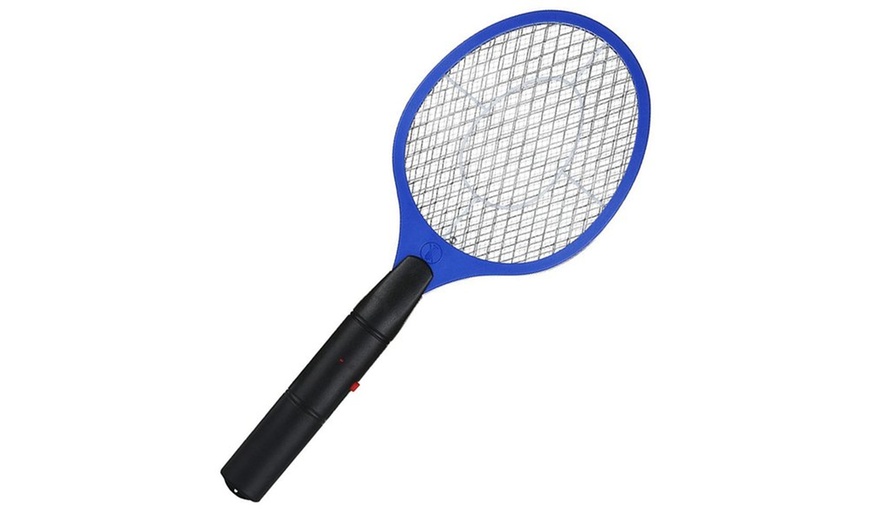
Locate an element on the screen. The width and height of the screenshot is (870, 524). black handle is located at coordinates (284, 427).